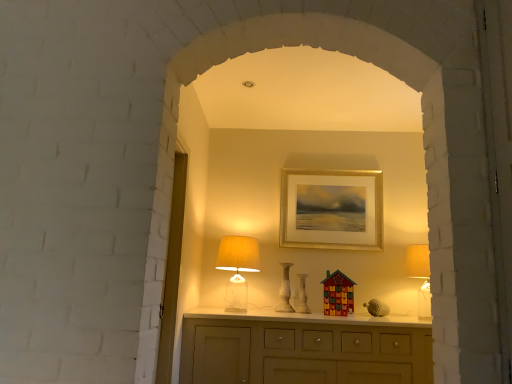
Question: Can you confirm if transparent glass door at left is wider than translucent glass table lamp at center?

Choices:
 (A) no
 (B) yes

Answer: (A)

Question: Is transparent glass door at left placed right next to translucent glass table lamp at center?

Choices:
 (A) yes
 (B) no

Answer: (B)

Question: Is transparent glass door at left positioned before translucent glass table lamp at center?

Choices:
 (A) yes
 (B) no

Answer: (A)

Question: From a real-world perspective, does transparent glass door at left sit lower than translucent glass table lamp at center?

Choices:
 (A) no
 (B) yes

Answer: (A)

Question: Can you confirm if transparent glass door at left is smaller than translucent glass table lamp at center?

Choices:
 (A) yes
 (B) no

Answer: (B)

Question: From their relative heights in the image, would you say white marble vase at center, which ranks as the second vase in left-to-right order, is taller or shorter than white marble vase at center, which is the first vase in left-to-right order?

Choices:
 (A) tall
 (B) short

Answer: (B)

Question: In the image, is white marble vase at center, which ranks as the second vase in left-to-right order, positioned in front of or behind white marble vase at center, arranged as the 2th vase when viewed from the right?

Choices:
 (A) front
 (B) behind

Answer: (A)

Question: In the image, is white marble vase at center, the 1th vase viewed from the right, on the left side or the right side of white marble vase at center, which is the first vase in left-to-right order?

Choices:
 (A) right
 (B) left

Answer: (A)

Question: Is point (301, 311) closer or farther from the camera than point (284, 294)?

Choices:
 (A) closer
 (B) farther

Answer: (A)

Question: Looking at the image, does gold/glossy picture frame at upper center seem bigger or smaller compared to white marble vase at center, which is the first vase in left-to-right order?

Choices:
 (A) small
 (B) big

Answer: (B)

Question: From the image's perspective, is gold/glossy picture frame at upper center above or below white marble vase at center, arranged as the 2th vase when viewed from the right?

Choices:
 (A) above
 (B) below

Answer: (A)

Question: From their relative heights in the image, would you say gold/glossy picture frame at upper center is taller or shorter than white marble vase at center, arranged as the 2th vase when viewed from the right?

Choices:
 (A) short
 (B) tall

Answer: (B)

Question: From a real-world perspective, is gold/glossy picture frame at upper center above or below white marble vase at center, arranged as the 2th vase when viewed from the right?

Choices:
 (A) above
 (B) below

Answer: (A)

Question: Is white marble vase at center, arranged as the 2th vase when viewed from the right, to the left or to the right of gold/glossy picture frame at upper center in the image?

Choices:
 (A) right
 (B) left

Answer: (B)

Question: Is white marble vase at center, which is the first vase in left-to-right order, inside the boundaries of gold/glossy picture frame at upper center, or outside?

Choices:
 (A) outside
 (B) inside

Answer: (A)